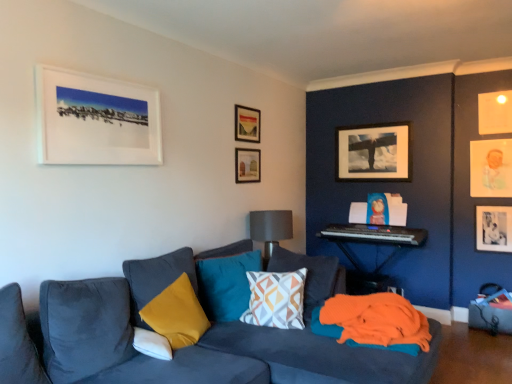
Describe the element at coordinates (374, 234) in the screenshot. I see `black plastic keyboard at right` at that location.

Identify the location of orange knitted blanket at lower right. The width and height of the screenshot is (512, 384). (373, 322).

Identify the location of black plastic keyboard at right. (374, 234).

From the picture: Is black plastic keyboard at right taller or shorter than orange knitted blanket at lower right?

black plastic keyboard at right is taller than orange knitted blanket at lower right.

Between black plastic keyboard at right and orange knitted blanket at lower right, which one is positioned in front?

orange knitted blanket at lower right is more forward.

Is black plastic keyboard at right wider or thinner than orange knitted blanket at lower right?

Considering their sizes, black plastic keyboard at right looks slimmer than orange knitted blanket at lower right.

From a real-world perspective, is black plastic keyboard at right above or below orange knitted blanket at lower right?

black plastic keyboard at right is situated higher than orange knitted blanket at lower right in the real world.

Is white soft pillow at lower left, the first pillow positioned from the front, closer to the viewer compared to velvet yellow pillow at lower left, the second pillow from the front?

Yes, white soft pillow at lower left, the first pillow positioned from the front, is closer to the viewer.

Is white soft pillow at lower left, the first pillow positioned from the front, thinner than velvet yellow pillow at lower left, the second pillow from the front?

Yes, white soft pillow at lower left, the first pillow positioned from the front, is thinner than velvet yellow pillow at lower left, the second pillow from the front.

Are white soft pillow at lower left, the fourth pillow positioned from the back, and velvet yellow pillow at lower left, the second pillow from the front, beside each other?

No, white soft pillow at lower left, the fourth pillow positioned from the back, is not next to velvet yellow pillow at lower left, the second pillow from the front.

From the picture: Is velvet yellow pillow at lower left, the second pillow from the front, at the back of white soft pillow at lower left, the fourth pillow positioned from the back?

Absolutely, white soft pillow at lower left, the fourth pillow positioned from the back, is directed away from velvet yellow pillow at lower left, the second pillow from the front.

Is wooden picture frame at center, which is counted as the 5th picture frame, starting from the right, taller than pastel paper portrait at upper right, which is the 3th picture frame from back to front?

No, wooden picture frame at center, which is counted as the 5th picture frame, starting from the right, is not taller than pastel paper portrait at upper right, which is the 3th picture frame from back to front.

From a real-world perspective, is wooden picture frame at center, the 3th picture frame from the front, physically located above or below pastel paper portrait at upper right, which is the 3th picture frame from back to front?

wooden picture frame at center, the 3th picture frame from the front, is above pastel paper portrait at upper right, which is the 3th picture frame from back to front.

How far apart are wooden picture frame at center, which is counted as the 5th picture frame, starting from the right, and pastel paper portrait at upper right, the 3th picture frame when ordered from right to left?

wooden picture frame at center, which is counted as the 5th picture frame, starting from the right, and pastel paper portrait at upper right, the 3th picture frame when ordered from right to left, are 6.87 feet apart.

Is wooden picture frame at center, the 3th picture frame from the front, to the left or to the right of pastel paper portrait at upper right, which is the 5th picture frame from left to right, in the image?

From the image, it's evident that wooden picture frame at center, the 3th picture frame from the front, is to the left of pastel paper portrait at upper right, which is the 5th picture frame from left to right.

Is black plastic keyboard at right next to geometric-patterned fabric pillow at center, which is the 2th pillow in back-to-front order?

black plastic keyboard at right and geometric-patterned fabric pillow at center, which is the 2th pillow in back-to-front order, are clearly separated.

Is black plastic keyboard at right spatially inside geometric-patterned fabric pillow at center, which is the 2th pillow in back-to-front order, or outside of it?

black plastic keyboard at right is not inside geometric-patterned fabric pillow at center, which is the 2th pillow in back-to-front order, it's outside.

How different are the orientations of black plastic keyboard at right and geometric-patterned fabric pillow at center, which is the 2th pillow in back-to-front order, in degrees?

black plastic keyboard at right and geometric-patterned fabric pillow at center, which is the 2th pillow in back-to-front order, are facing 20.4 degrees away from each other.

From the image's perspective, would you say black plastic keyboard at right is positioned over geometric-patterned fabric pillow at center, the third pillow from the front?

Yes.

From a real-world perspective, relative to wooden picture frame at center, acting as the fifth picture frame starting from the back, is matte white picture frame at upper right, acting as the fourth picture frame starting from the front, vertically above or below?

In terms of real-world spatial position, matte white picture frame at upper right, acting as the fourth picture frame starting from the front, is above wooden picture frame at center, acting as the fifth picture frame starting from the back.

Would you say matte white picture frame at upper right, arranged as the 6th picture frame when viewed from the left, is a long distance from wooden picture frame at center, which is counted as the 5th picture frame, starting from the right?

Absolutely, matte white picture frame at upper right, arranged as the 6th picture frame when viewed from the left, is distant from wooden picture frame at center, which is counted as the 5th picture frame, starting from the right.

How many degrees apart are the facing directions of matte white picture frame at upper right, acting as the fourth picture frame starting from the front, and wooden picture frame at center, acting as the fifth picture frame starting from the back?

89.3 degrees.

At what (x,y) coordinates should I click in order to perform the action: click on the 4th picture frame directly above the wooden picture frame at center, which is counted as the 5th picture frame, starting from the right (from a real-world perspective). Please return your answer as a coordinate pair (x, y). The image size is (512, 384). Looking at the image, I should click on (495, 112).

Consider the image. Considering the relative sizes of pastel paper portrait at upper right, the 3th picture frame when ordered from right to left, and gray fabric lampshade at center in the image provided, is pastel paper portrait at upper right, the 3th picture frame when ordered from right to left, smaller than gray fabric lampshade at center?

Yes.

Based on the photo, from the image's perspective, is pastel paper portrait at upper right, acting as the 5th picture frame starting from the front, above or below gray fabric lampshade at center?

pastel paper portrait at upper right, acting as the 5th picture frame starting from the front, is situated higher than gray fabric lampshade at center in the image.

Does pastel paper portrait at upper right, which is the 3th picture frame from back to front, have a greater width compared to gray fabric lampshade at center?

In fact, pastel paper portrait at upper right, which is the 3th picture frame from back to front, might be narrower than gray fabric lampshade at center.

Considering the positions of points (262, 312) and (146, 354), is point (262, 312) farther from camera compared to point (146, 354)?

Yes, point (262, 312) is farther from viewer.

Between geometric-patterned fabric pillow at center, which is the 2th pillow in back-to-front order, and white soft pillow at lower left, the first pillow positioned from the front, which one has less height?

With less height is white soft pillow at lower left, the first pillow positioned from the front.

Considering the relative sizes of geometric-patterned fabric pillow at center, which is the 2th pillow in back-to-front order, and white soft pillow at lower left, the fourth pillow positioned from the back, in the image provided, is geometric-patterned fabric pillow at center, which is the 2th pillow in back-to-front order, bigger than white soft pillow at lower left, the fourth pillow positioned from the back,?

Yes, geometric-patterned fabric pillow at center, which is the 2th pillow in back-to-front order, is bigger than white soft pillow at lower left, the fourth pillow positioned from the back.

The image size is (512, 384). What are the coordinates of `material on the left of black plastic keyboard at right` in the screenshot? It's located at (373, 322).

From the white soft pillow at lower left, the first pillow positioned from the front, count 1st pillows backward and point to it. Please provide its 2D coordinates.

[(168, 296)]

Estimate the real-world distances between objects in this image. Which object is closer to pastel paper portrait at upper right, which is the 3th picture frame from back to front, geometric-patterned fabric pillow at center, which is the 2th pillow in back-to-front order, or white soft pillow at lower left, the first pillow positioned from the front?

geometric-patterned fabric pillow at center, which is the 2th pillow in back-to-front order.

When comparing their distances from pastel paper portrait at upper right, which is the 5th picture frame from left to right, does orange knitted blanket at lower right or black matte photo frame at right, the first picture frame in the right-to-left sequence, seem closer?

black matte photo frame at right, the first picture frame in the right-to-left sequence, lies closer to pastel paper portrait at upper right, which is the 5th picture frame from left to right, than the other object.

Based on the photo, considering their positions, is black plastic keyboard at right positioned further to orange fabric at lower right than matte black picture frame at upper right, marked as the 4th picture frame in a right-to-left arrangement?

matte black picture frame at upper right, marked as the 4th picture frame in a right-to-left arrangement, lies further to orange fabric at lower right than the other object.

Which object lies nearer to the anchor point yellow fabric pillow at center, acting as the 4th pillow starting from the front, matte wooden picture frame at upper center, the 2th picture frame viewed from the front, or orange fabric at lower right?

Among the two, matte wooden picture frame at upper center, the 2th picture frame viewed from the front, is located nearer to yellow fabric pillow at center, acting as the 4th pillow starting from the front.

Based on their spatial positions, is matte wooden picture frame at upper center, positioned as the 6th picture frame in right-to-left order, or wooden picture frame at center, the 3th picture frame from the front, closer to matte white picture frame at upper right, marked as the 4th picture frame in a back-to-front arrangement?

The object closer to matte white picture frame at upper right, marked as the 4th picture frame in a back-to-front arrangement, is matte wooden picture frame at upper center, positioned as the 6th picture frame in right-to-left order.

Based on their spatial positions, is yellow fabric pillow at center, acting as the 4th pillow starting from the front, or matte black picture frame at upper right, which is counted as the first picture frame, starting from the back, closer to white matte picture frame at upper left, which is counted as the seventh picture frame, starting from the right?

yellow fabric pillow at center, acting as the 4th pillow starting from the front.

Considering their positions, is orange knitted blanket at lower right positioned further to gray fabric lampshade at center than yellow fabric pillow at center, acting as the 4th pillow starting from the front?

orange knitted blanket at lower right.

Based on their spatial positions, is matte white picture frame at upper right, arranged as the 6th picture frame when viewed from the left, or white soft pillow at lower left, the first pillow positioned from the front, closer to geometric-patterned fabric pillow at center, which is the 2th pillow in back-to-front order?

Based on the image, white soft pillow at lower left, the first pillow positioned from the front, appears to be nearer to geometric-patterned fabric pillow at center, which is the 2th pillow in back-to-front order.

Where is `table between wooden picture frame at center, the 3th picture frame from the front, and matte black picture frame at upper right, which is counted as the first picture frame, starting from the back`? The image size is (512, 384). table between wooden picture frame at center, the 3th picture frame from the front, and matte black picture frame at upper right, which is counted as the first picture frame, starting from the back is located at coordinates (375, 244).

Identify the location of piano located between yellow fabric pillow at center, acting as the 4th pillow starting from the front, and pastel paper portrait at upper right, the 3th picture frame when ordered from right to left, in the left-right direction. (374, 234).

Find the location of a particular element. Image resolution: width=512 pixels, height=384 pixels. pillow between matte wooden picture frame at upper center, the 2th picture frame viewed from the front, and geometric-patterned fabric pillow at center, which is the 2th pillow in back-to-front order, from top to bottom is located at coordinates (226, 284).

Locate an element on the screen. This screenshot has width=512, height=384. picture frame between black plastic keyboard at right and pastel paper portrait at upper right, which is the 5th picture frame from left to right is located at coordinates (373, 153).